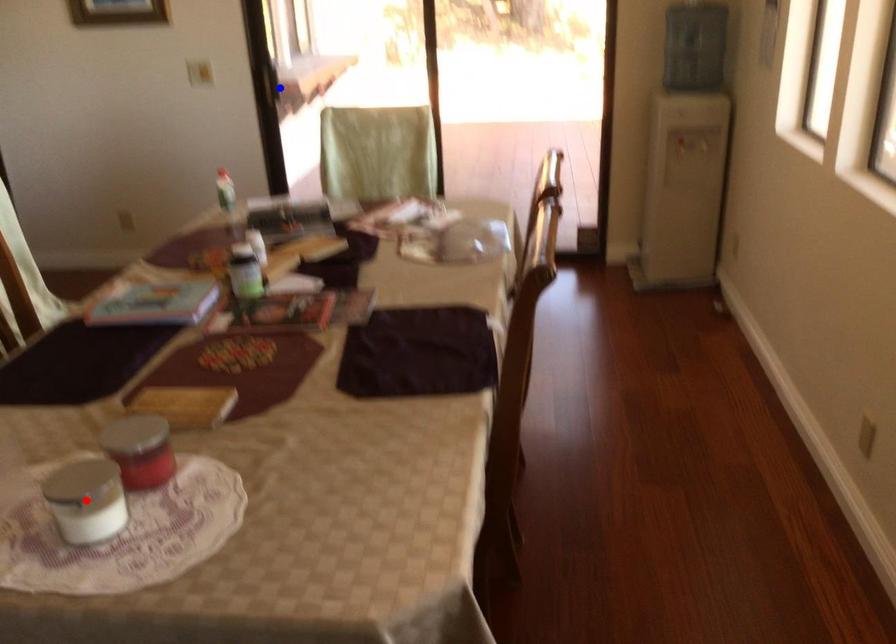
Question: Two points are marked on the image. Which point is closer to the camera?

Choices:
 (A) Blue point is closer.
 (B) Red point is closer.

Answer: (B)